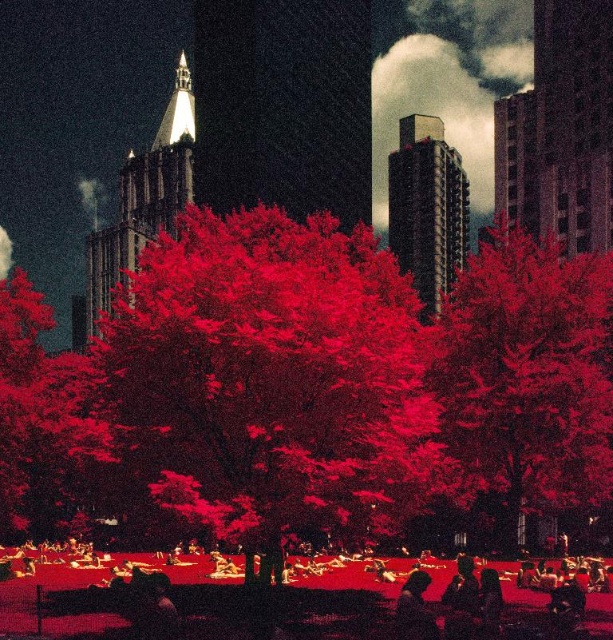
Measure the distance between vivid red leaves at center and smooth skin person at lower center.

They are 11.53 meters apart.

Consider the image. Is vivid red leaves at center closer to the viewer compared to smooth skin person at lower center?

No, it is behind smooth skin person at lower center.

The image size is (613, 640). I want to click on vivid red leaves at center, so click(272, 378).

Find the location of a particular element. The height and width of the screenshot is (640, 613). vivid red leaves at center is located at coordinates (272, 378).

Is bright red leaves at center closer to the viewer compared to smooth skin person at lower center?

No, bright red leaves at center is further to the viewer.

Can you confirm if bright red leaves at center is taller than smooth skin person at lower center?

Yes.

The image size is (613, 640). Describe the element at coordinates (527, 376) in the screenshot. I see `bright red leaves at center` at that location.

I want to click on bright red leaves at center, so click(x=527, y=376).

Is vivid red leaves at center smaller than smooth skin person at lower right?

No, vivid red leaves at center is not smaller than smooth skin person at lower right.

You are a GUI agent. You are given a task and a screenshot of the screen. Output one action in this format:
    pyautogui.click(x=<x>, y=<y>)
    Task: Click on the vivid red leaves at center
    The height and width of the screenshot is (640, 613).
    Given the screenshot: What is the action you would take?
    pyautogui.click(x=272, y=378)

Describe the element at coordinates (272, 378) in the screenshot. This screenshot has width=613, height=640. I see `vivid red leaves at center` at that location.

This screenshot has width=613, height=640. Identify the location of vivid red leaves at center. (272, 378).